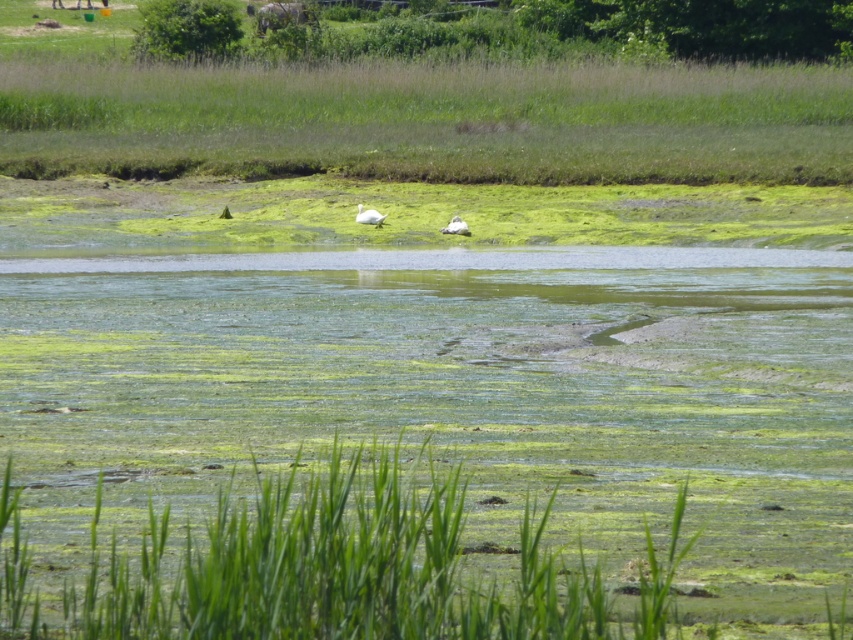
You are a photographer trying to capture both the white feathered bird at upper center and the white matte duck at center in a single frame. Which bird should you focus on to ensure both are in the shot without moving the camera?

You should focus on the white feathered bird at upper center because it is wider than the white matte duck at center, allowing the camera to capture both in the frame.

You are a photographer trying to capture both the white feathered bird at upper center and the white matte duck at center in a single shot. Based on their positions, which bird should you focus on first to ensure both are in the frame?

The white feathered bird at upper center is above the white matte duck at center, so focusing on the white feathered bird at upper center first will ensure both are included in the shot.

You are a photographer trying to capture a shot of the white feathered bird at upper center and the green leafy grass at lower center. Based on their positions, which object is located to the right of the other?

The green leafy grass at lower center is positioned on the right side of white feathered bird at upper center.